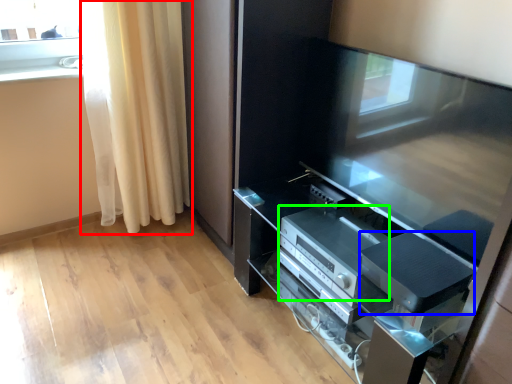
Question: Which object is positioned closest to curtain (highlighted by a red box)? Select from appliance (highlighted by a blue box) and appliance (highlighted by a green box).

Choices:
 (A) appliance
 (B) appliance

Answer: (B)